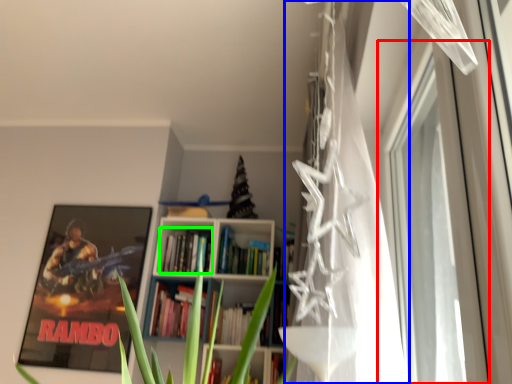
Question: Which is farther away from window (highlighted by a red box)? curtain (highlighted by a blue box) or book (highlighted by a green box)?

Choices:
 (A) curtain
 (B) book

Answer: (B)